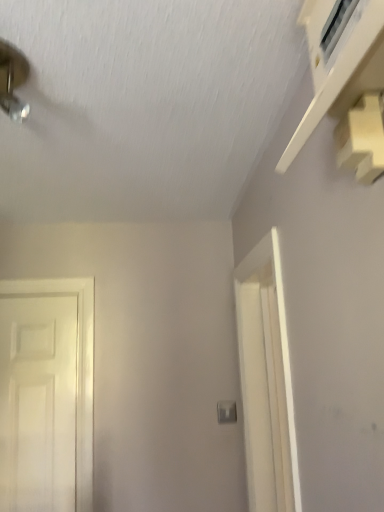
Question: Do you think white matte door at left is within white plastic light switch at center, or outside of it?

Choices:
 (A) outside
 (B) inside

Answer: (A)

Question: From a real-world perspective, relative to white plastic light switch at center, is white matte door at left vertically above or below?

Choices:
 (A) below
 (B) above

Answer: (B)

Question: In terms of size, does white matte door at left appear bigger or smaller than white plastic light switch at center?

Choices:
 (A) small
 (B) big

Answer: (B)

Question: In the image, is white plastic light switch at center on the left side or the right side of white matte door at left?

Choices:
 (A) right
 (B) left

Answer: (A)

Question: In the image, is white plastic light switch at center positioned in front of or behind white matte door at left?

Choices:
 (A) front
 (B) behind

Answer: (B)

Question: From the image's perspective, is white plastic light switch at center located above or below white matte door at left?

Choices:
 (A) above
 (B) below

Answer: (B)

Question: Considering the positions of white plastic light switch at center and white matte door at left in the image, is white plastic light switch at center wider or thinner than white matte door at left?

Choices:
 (A) thin
 (B) wide

Answer: (A)